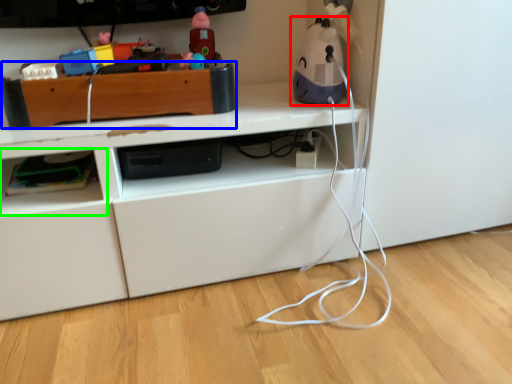
Question: Based on their relative distances, which object is farther from toy (highlighted by a red box)? Choose from shelf (highlighted by a blue box) and shelf (highlighted by a green box).

Choices:
 (A) shelf
 (B) shelf

Answer: (B)